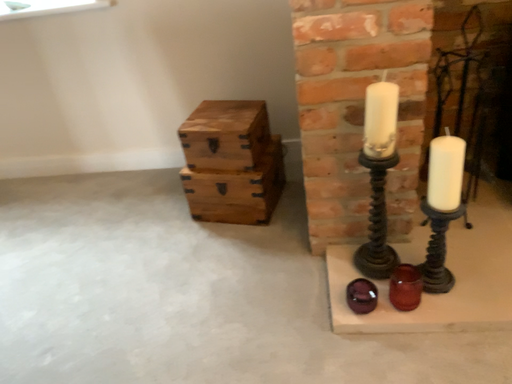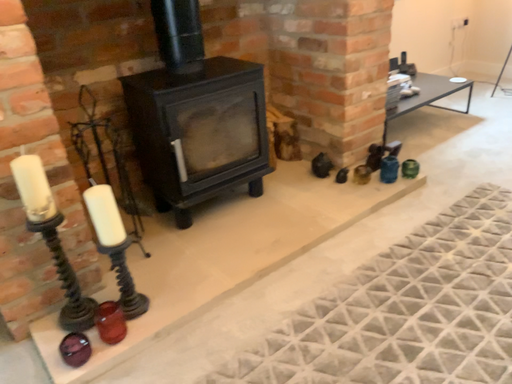
Question: Which way did the camera rotate in the video?

Choices:
 (A) rotated left
 (B) rotated right

Answer: (B)